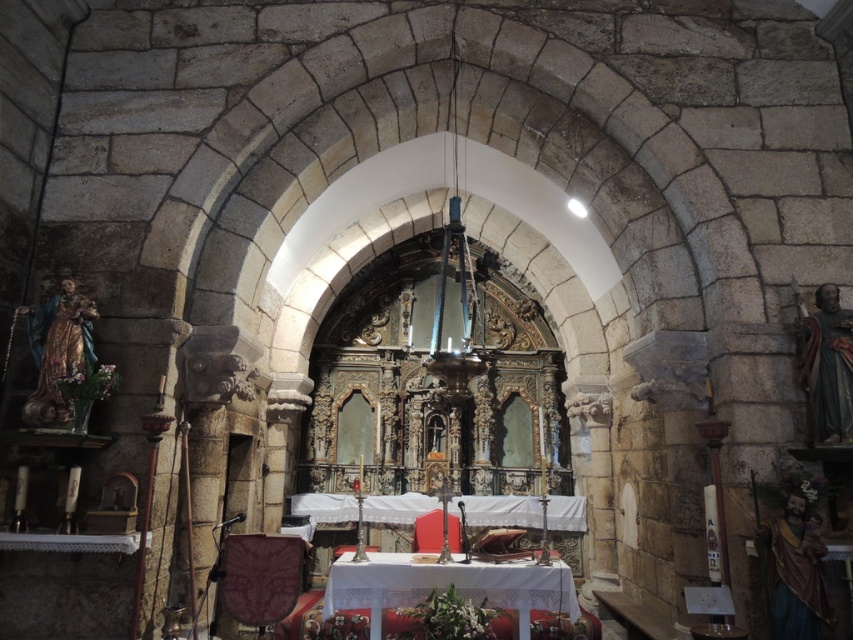
Question: Is velvet purple chair at center to the left of velvet red chair at center from the viewer's perspective?

Choices:
 (A) yes
 (B) no

Answer: (A)

Question: Does velvet purple chair at center have a larger size compared to velvet red chair at center?

Choices:
 (A) no
 (B) yes

Answer: (B)

Question: Where is velvet purple chair at center located in relation to velvet red chair at center in the image?

Choices:
 (A) below
 (B) above

Answer: (B)

Question: Which point is farther to the camera?

Choices:
 (A) (418, 532)
 (B) (287, 586)

Answer: (A)